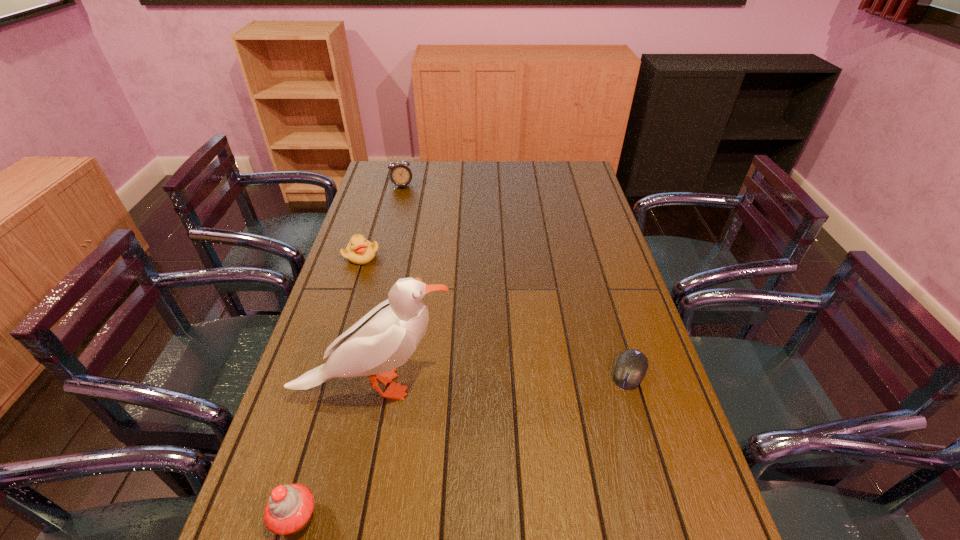
Where is `computer mouse`? The width and height of the screenshot is (960, 540). computer mouse is located at coordinates (632, 364).

Find the location of a particular element. The height and width of the screenshot is (540, 960). the rightmost object is located at coordinates (632, 364).

Locate an element on the screen. the farthest object is located at coordinates (400, 174).

Find the location of a particular element. the second shortest object is located at coordinates (360, 251).

At what (x,y) coordinates should I click in order to perform the action: click on duckling. Please return your answer as a coordinate pair (x, y). This screenshot has height=540, width=960. Looking at the image, I should click on (360, 251).

The height and width of the screenshot is (540, 960). In order to click on the tallest object in this screenshot , I will do `click(385, 338)`.

Locate an element on the screen. The image size is (960, 540). vacant space located on the left of the shortest object is located at coordinates (491, 372).

Image resolution: width=960 pixels, height=540 pixels. In order to click on free space located 0.170m on the face of the alarm clock in this screenshot , I will do `click(415, 213)`.

The width and height of the screenshot is (960, 540). I want to click on vacant space located 0.330m on the face of the alarm clock, so click(425, 237).

Identify the location of vacant space located on the face of the alarm clock. (418, 220).